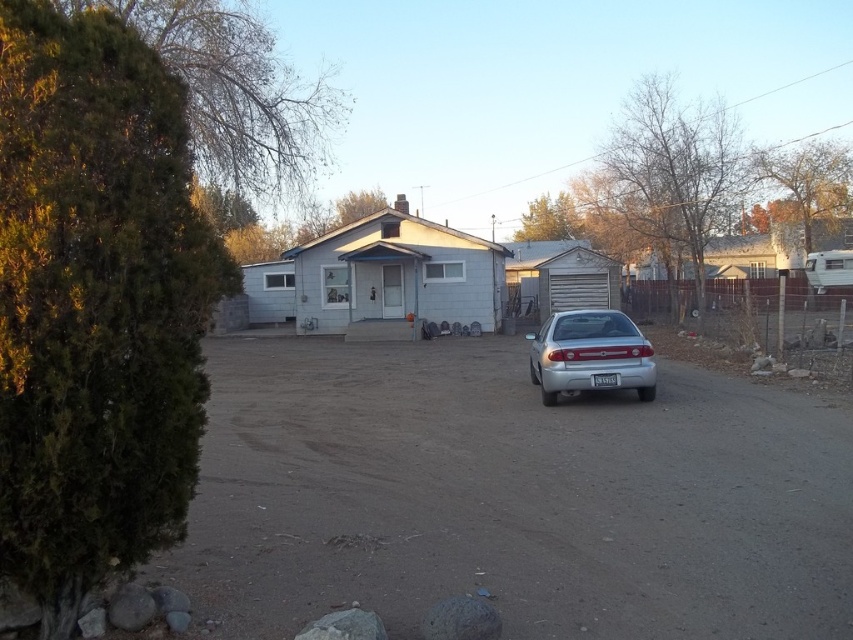
Does dirt track at center have a larger size compared to silver metallic sedan at center?

Correct, dirt track at center is larger in size than silver metallic sedan at center.

This screenshot has height=640, width=853. Describe the element at coordinates (512, 497) in the screenshot. I see `dirt track at center` at that location.

The image size is (853, 640). I want to click on dirt track at center, so click(x=512, y=497).